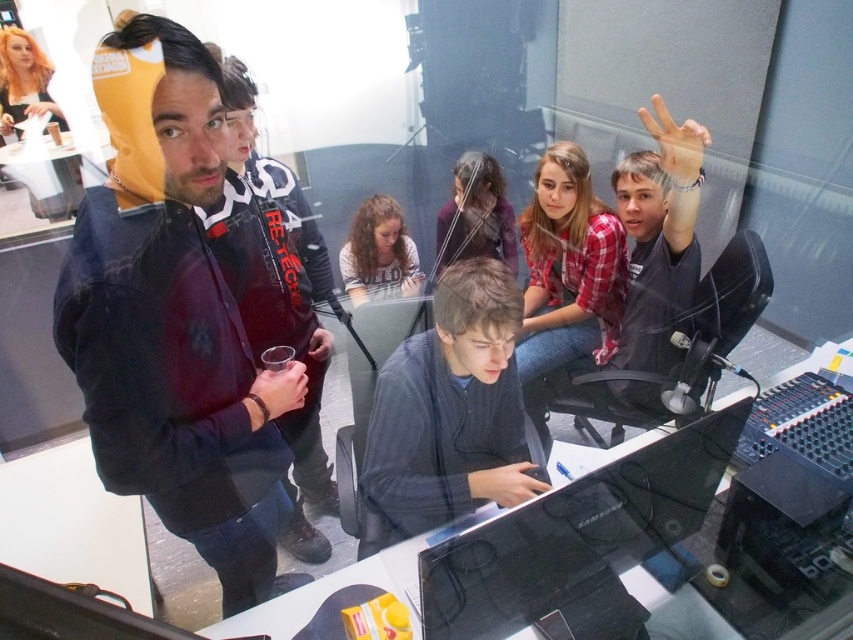
Which is more to the left, black glossy monitor at center or curly hair at center?

curly hair at center

Is black glossy monitor at center closer to camera compared to curly hair at center?

Yes, black glossy monitor at center is closer to the viewer.

Is point (611, 580) behind point (345, 289)?

That is False.

Where is `black glossy monitor at center`? This screenshot has width=853, height=640. black glossy monitor at center is located at coordinates (581, 540).

Is dark gray sweater at center bigger than transparent glass table at center?

No.

Who is shorter, dark gray sweater at center or transparent glass table at center?

transparent glass table at center is shorter.

Locate an element on the screen. dark gray sweater at center is located at coordinates (448, 413).

Does black glossy monitor at center appear on the right side of dark brown hair at center?

Yes, black glossy monitor at center is to the right of dark brown hair at center.

Which is in front, point (584, 595) or point (473, 221)?

Positioned in front is point (584, 595).

What do you see at coordinates (581, 540) in the screenshot? I see `black glossy monitor at center` at bounding box center [581, 540].

Find the location of a particular element. Image resolution: width=853 pixels, height=640 pixels. black glossy monitor at center is located at coordinates (581, 540).